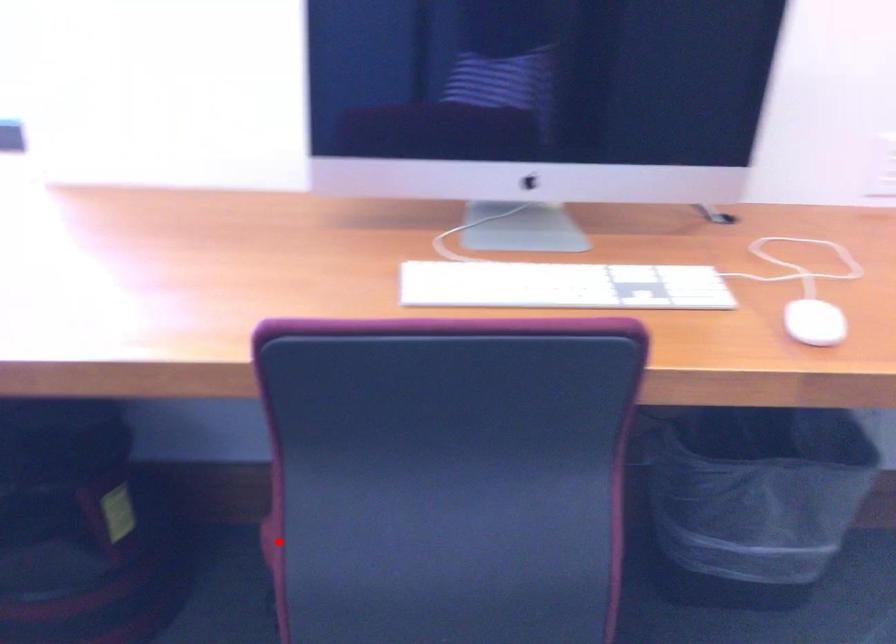
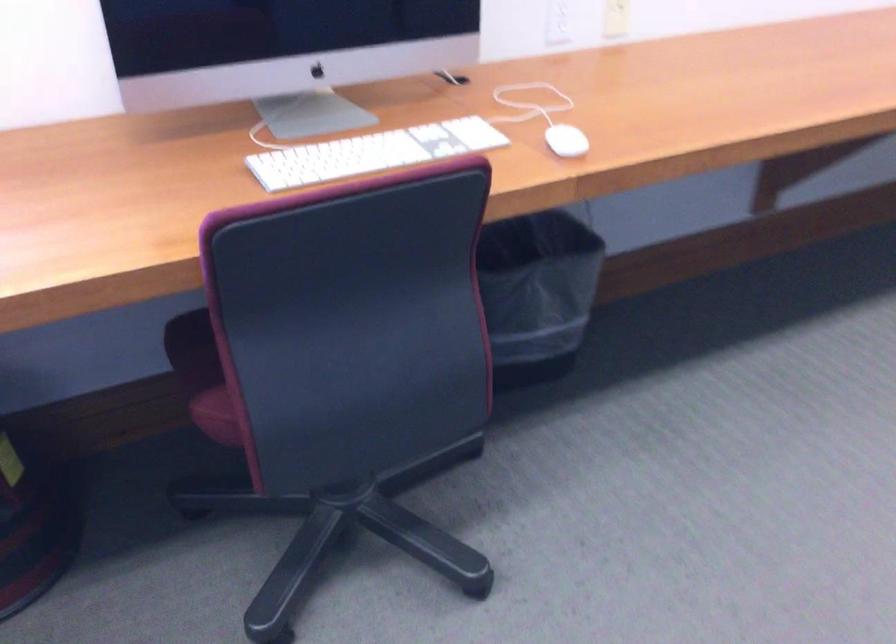
Question: A red point is marked in image1. In image2, is the corresponding 3D point closer to the camera or farther? Reply with the corresponding letter.

Choices:
 (A) The corresponding 3D point is closer.
 (B) The corresponding 3D point is farther.

Answer: (B)